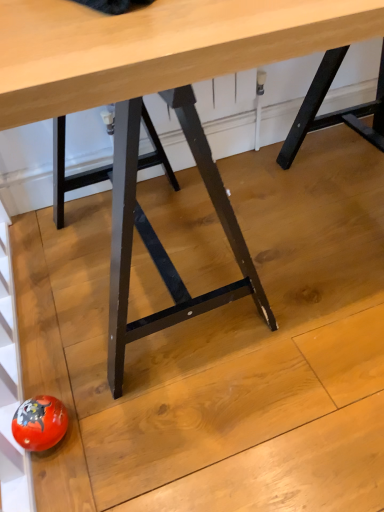
This screenshot has height=512, width=384. I want to click on vacant space to the right of shiny red ball at lower left, so click(122, 418).